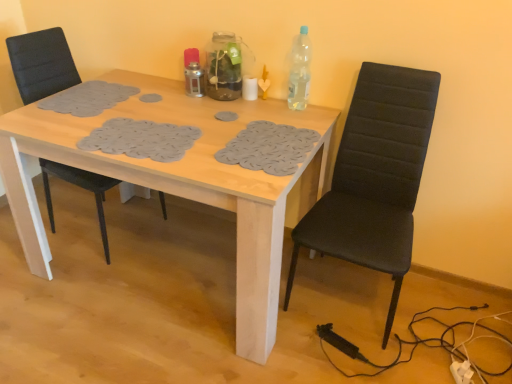
This screenshot has height=384, width=512. What are the coordinates of `vacant space to the right of clear plastic bottle at upper right` in the screenshot? It's located at (325, 111).